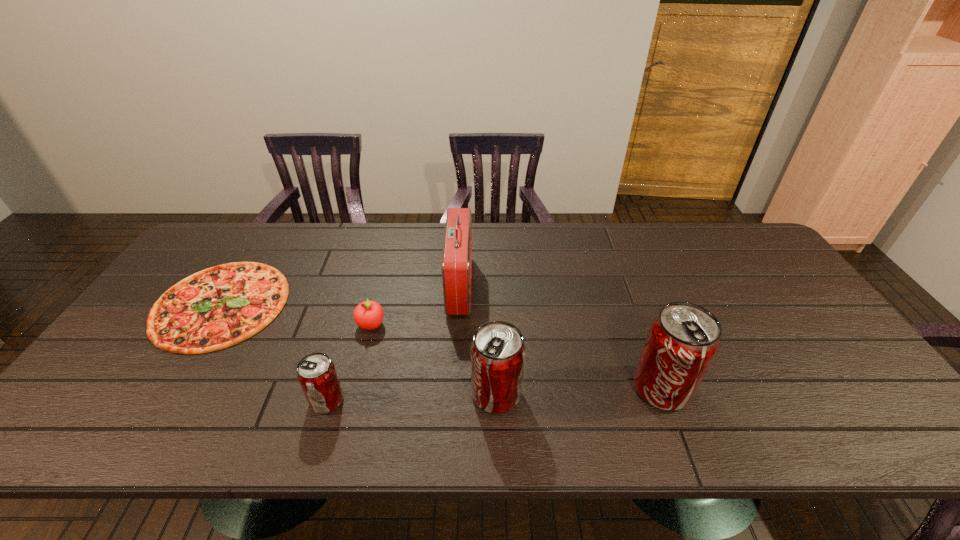
Where is `free location located on the back of the third tallest object`? free location located on the back of the third tallest object is located at coordinates (494, 334).

Locate an element on the screen. vacant space located on the back of the rightmost object is located at coordinates (641, 335).

Locate an element on the screen. free region located on the front of the shortest object is located at coordinates (165, 392).

At what (x,y) coordinates should I click in order to perform the action: click on free space located on the left of the apple. Please return your answer as a coordinate pair (x, y). This screenshot has width=960, height=540. Looking at the image, I should click on (334, 325).

The width and height of the screenshot is (960, 540). I want to click on vacant space located on the side of the fourth object from left to right with the first aid cross symbol, so click(579, 286).

Where is `pizza that is at the far edge`? The width and height of the screenshot is (960, 540). pizza that is at the far edge is located at coordinates (221, 306).

Locate an element on the screen. The image size is (960, 540). the first-aid kit that is positioned at the far edge is located at coordinates (457, 250).

At what (x,y) coordinates should I click in order to perform the action: click on object situated at the left edge. Please return your answer as a coordinate pair (x, y). This screenshot has width=960, height=540. Looking at the image, I should click on tap(221, 306).

Identify the location of object that is positioned at the far left corner. The image size is (960, 540). (221, 306).

Locate an element on the screen. free region at the far edge of the desktop is located at coordinates [505, 251].